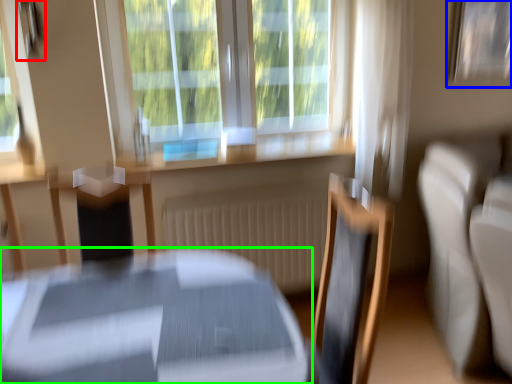
Question: Based on their relative distances, which object is nearer to picture frame (highlighted by a red box)? Choose from picture frame (highlighted by a blue box) and table (highlighted by a green box).

Choices:
 (A) picture frame
 (B) table

Answer: (B)